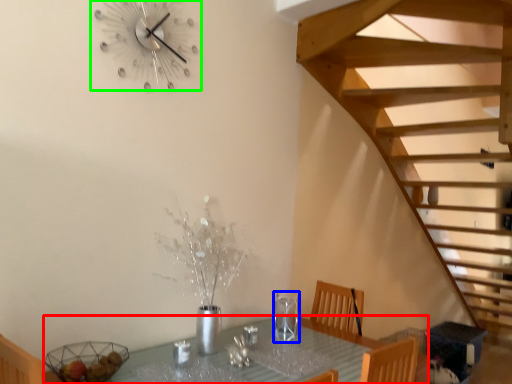
Question: Considering the real-world distances, which object is farthest from table (highlighted by a red box)? wine glass (highlighted by a blue box) or wall clock (highlighted by a green box)?

Choices:
 (A) wine glass
 (B) wall clock

Answer: (B)